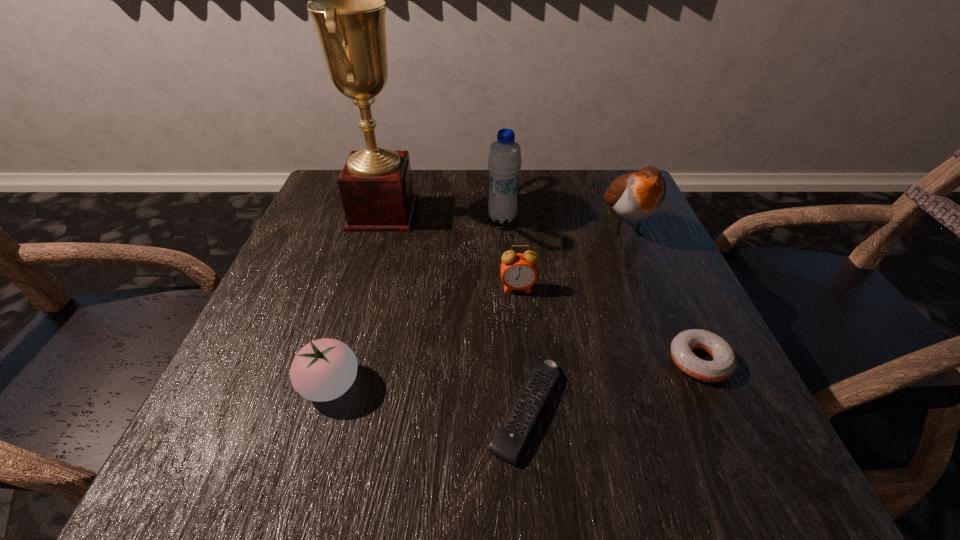
What are the coordinates of `bird that is at the right edge` in the screenshot? It's located at (636, 196).

Image resolution: width=960 pixels, height=540 pixels. Find the location of `doughnut present at the right edge`. doughnut present at the right edge is located at coordinates (724, 362).

Locate an element on the screen. The width and height of the screenshot is (960, 540). object located at the far left corner is located at coordinates (375, 184).

The image size is (960, 540). In order to click on object at the far right corner in this screenshot , I will do `click(636, 196)`.

The image size is (960, 540). Identify the location of vacant space at the far edge of the desktop. (548, 202).

Locate an element on the screen. The image size is (960, 540). blank area at the near edge is located at coordinates (518, 463).

This screenshot has width=960, height=540. In the image, there is a desktop. Find the location of `vacant space at the left edge`. vacant space at the left edge is located at coordinates (223, 419).

In the image, there is a desktop. Find the location of `free region at the right edge`. free region at the right edge is located at coordinates coord(624,337).

In the image, there is a desktop. Find the location of `free space at the far left corner`. free space at the far left corner is located at coordinates (336, 173).

Find the location of a particular element. The height and width of the screenshot is (540, 960). free space at the near right corner of the desktop is located at coordinates (666, 461).